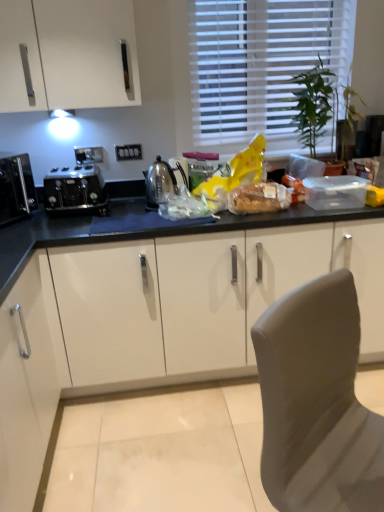
Question: Considering the relative sizes of matte brown bread at center, which is the 1th food in right-to-left order, and white blinds at upper center in the image provided, is matte brown bread at center, which is the 1th food in right-to-left order, smaller than white blinds at upper center?

Choices:
 (A) yes
 (B) no

Answer: (A)

Question: Is the position of matte brown bread at center, which is the 1th food in right-to-left order, more distant than that of white blinds at upper center?

Choices:
 (A) yes
 (B) no

Answer: (B)

Question: Are matte brown bread at center, which is the 1th food in right-to-left order, and white blinds at upper center making contact?

Choices:
 (A) yes
 (B) no

Answer: (B)

Question: Can you confirm if matte brown bread at center, which is the 1th food in right-to-left order, is thinner than white blinds at upper center?

Choices:
 (A) no
 (B) yes

Answer: (A)

Question: From the image's perspective, does matte brown bread at center, positioned as the second food in left-to-right order, appear higher than white blinds at upper center?

Choices:
 (A) no
 (B) yes

Answer: (A)

Question: Is white matte cabinet at lower left inside or outside of white blinds at upper center?

Choices:
 (A) inside
 (B) outside

Answer: (B)

Question: Considering their positions, is white matte cabinet at lower left located in front of or behind white blinds at upper center?

Choices:
 (A) front
 (B) behind

Answer: (A)

Question: Is white matte cabinet at lower left bigger or smaller than white blinds at upper center?

Choices:
 (A) small
 (B) big

Answer: (B)

Question: Is white matte cabinet at lower left taller or shorter than white blinds at upper center?

Choices:
 (A) tall
 (B) short

Answer: (B)

Question: Based on their positions, is translucent plastic bag at center, marked as the first food in a left-to-right arrangement, located to the left or right of matte brown bread at center, which is the 1th food in right-to-left order?

Choices:
 (A) right
 (B) left

Answer: (B)

Question: Considering the positions of point (180, 214) and point (249, 194), is point (180, 214) closer or farther from the camera than point (249, 194)?

Choices:
 (A) farther
 (B) closer

Answer: (B)

Question: From their relative heights in the image, would you say translucent plastic bag at center, positioned as the second food in right-to-left order, is taller or shorter than matte brown bread at center, which is the 1th food in right-to-left order?

Choices:
 (A) short
 (B) tall

Answer: (A)

Question: Based on their sizes in the image, would you say translucent plastic bag at center, marked as the first food in a left-to-right arrangement, is bigger or smaller than matte brown bread at center, positioned as the second food in left-to-right order?

Choices:
 (A) big
 (B) small

Answer: (B)

Question: Is green leafy plant at upper right in front of or behind satin silver kettle at center in the image?

Choices:
 (A) behind
 (B) front

Answer: (B)

Question: Considering the positions of green leafy plant at upper right and satin silver kettle at center in the image, is green leafy plant at upper right bigger or smaller than satin silver kettle at center?

Choices:
 (A) big
 (B) small

Answer: (A)